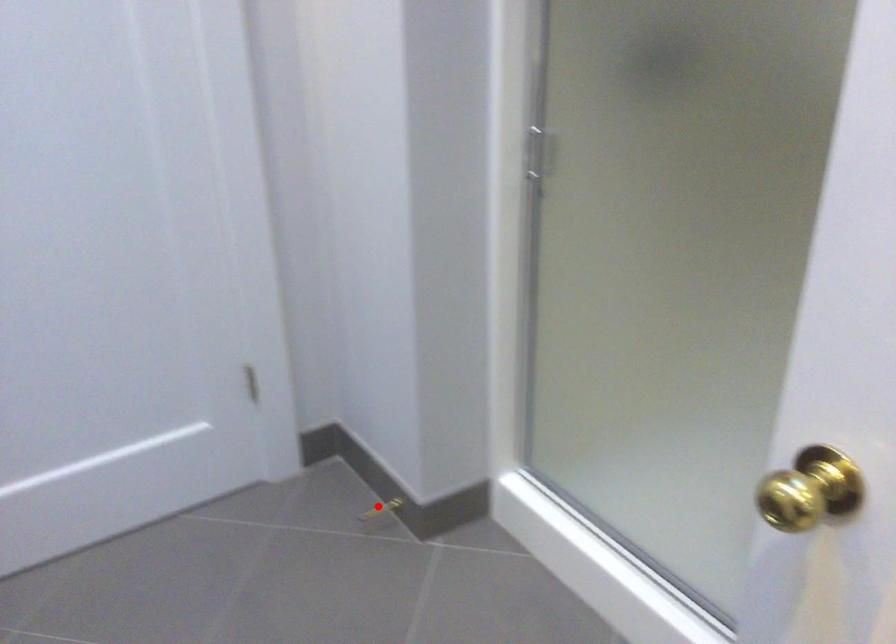
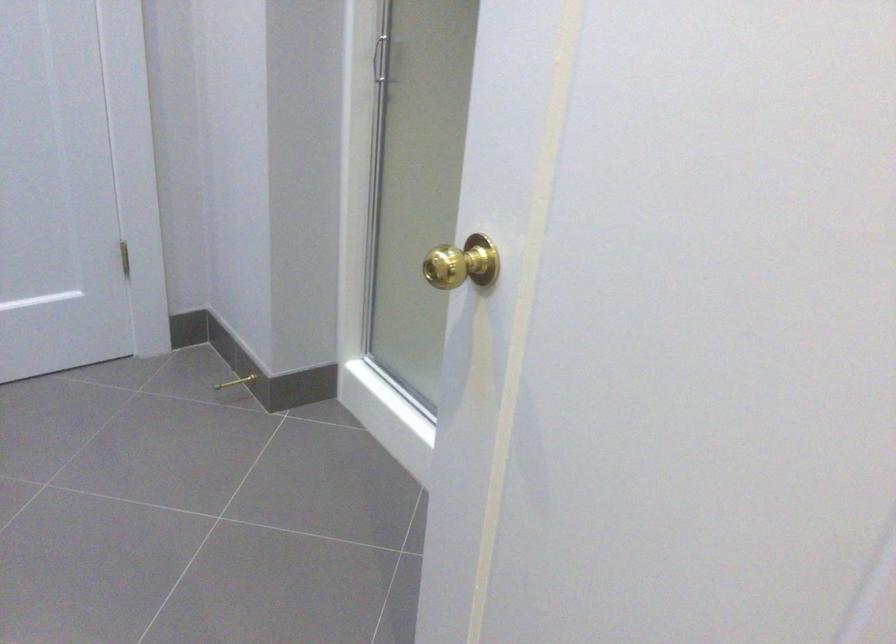
Question: I am providing you with two images of the same scene from different viewpoints. In image1, a red point is highlighted. Considering the same 3D point in image2, which of the following is correct?

Choices:
 (A) It is closer
 (B) It is farther

Answer: (B)